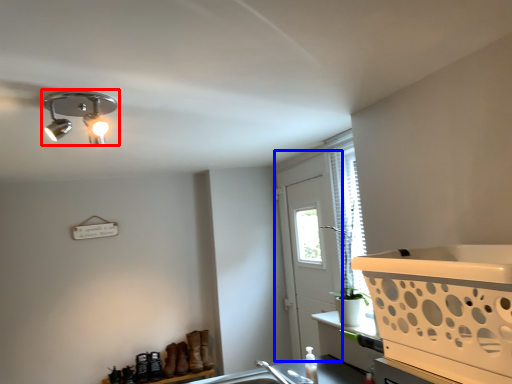
Question: Which point is closer to the camera, lamp (highlighted by a red box) or screen door (highlighted by a blue box)?

Choices:
 (A) lamp
 (B) screen door

Answer: (A)